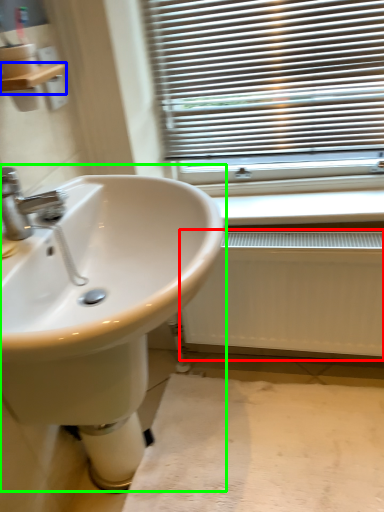
Question: Considering the real-world distances, which object is farthest from radiator (highlighted by a red box)? balustrade (highlighted by a blue box) or sink (highlighted by a green box)?

Choices:
 (A) balustrade
 (B) sink

Answer: (A)